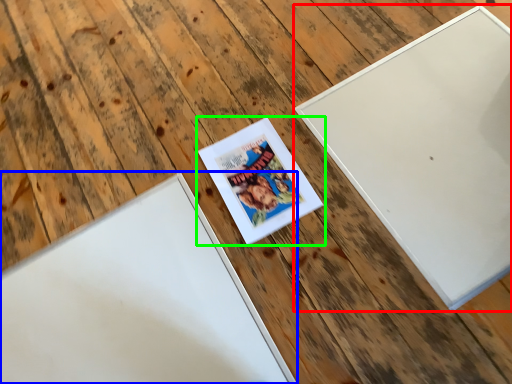
Question: Based on their relative distances, which object is nearer to picture frame (highlighted by a red box)? Choose from picture frame (highlighted by a blue box) and picture frame (highlighted by a green box).

Choices:
 (A) picture frame
 (B) picture frame

Answer: (B)